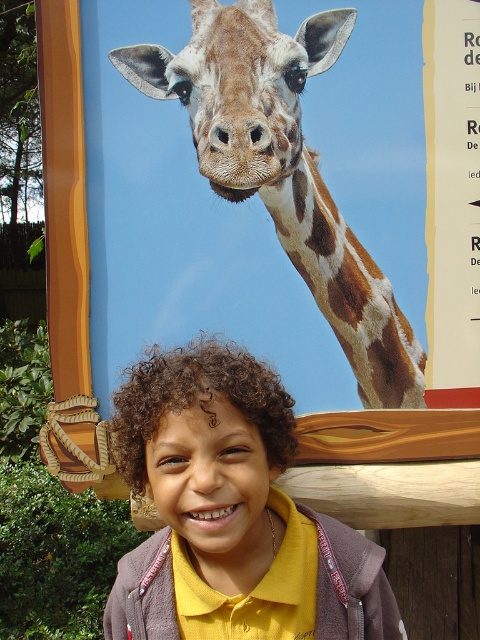
Question: Is curly-haired child at center below brown spotted skin at upper center?

Choices:
 (A) no
 (B) yes

Answer: (B)

Question: Is curly-haired child at center positioned before brown spotted skin at upper center?

Choices:
 (A) yes
 (B) no

Answer: (A)

Question: Is curly-haired child at center bigger than brown spotted skin at upper center?

Choices:
 (A) yes
 (B) no

Answer: (A)

Question: Which of the following is the farthest from the observer?

Choices:
 (A) brown spotted skin at upper center
 (B) curly-haired child at center

Answer: (A)

Question: Which of the following is the farthest from the observer?

Choices:
 (A) curly-haired child at center
 (B) brown spotted skin at upper center

Answer: (B)

Question: Among these points, which one is nearest to the camera?

Choices:
 (A) (277, 550)
 (B) (372, 321)

Answer: (A)